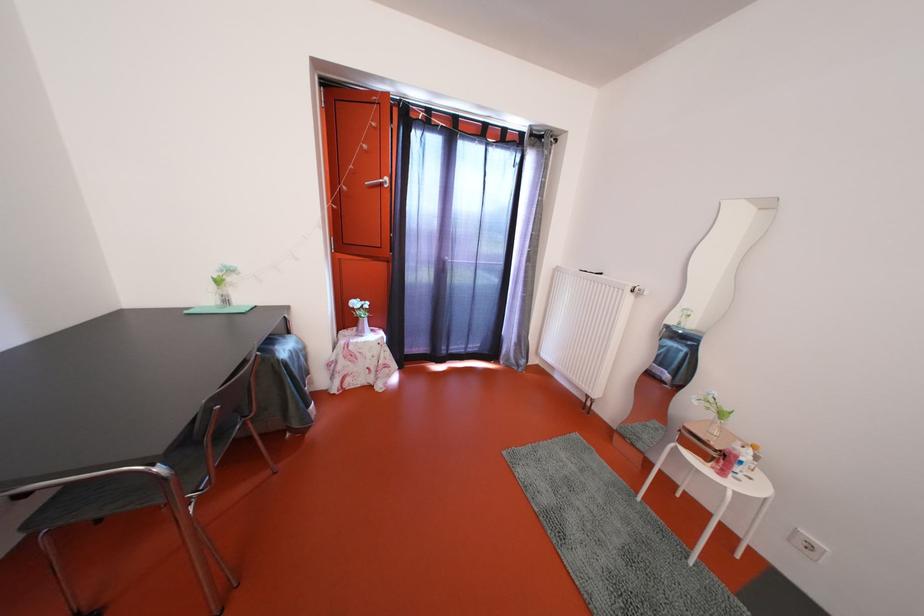
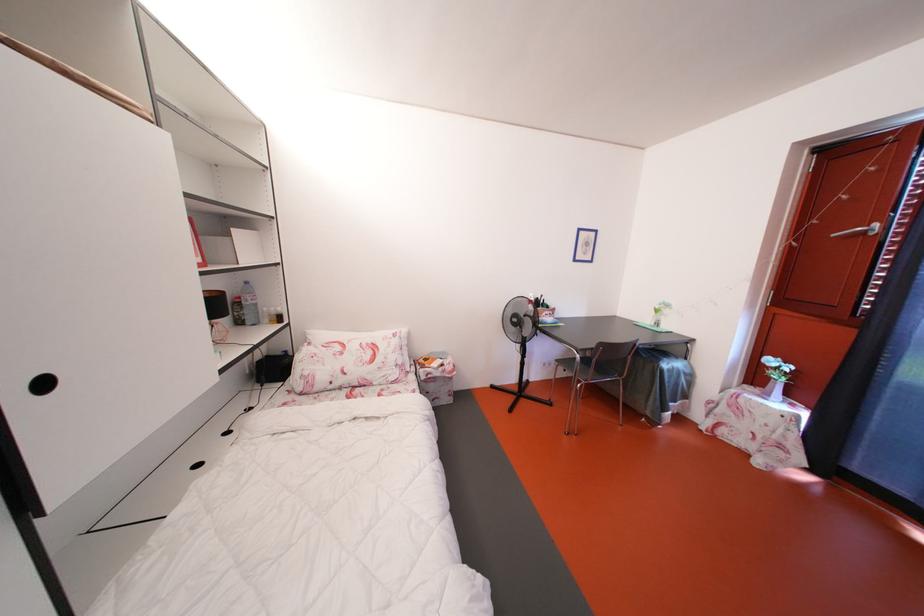
The point at (361, 309) is marked in the first image. Where is the corresponding point in the second image?

(779, 367)